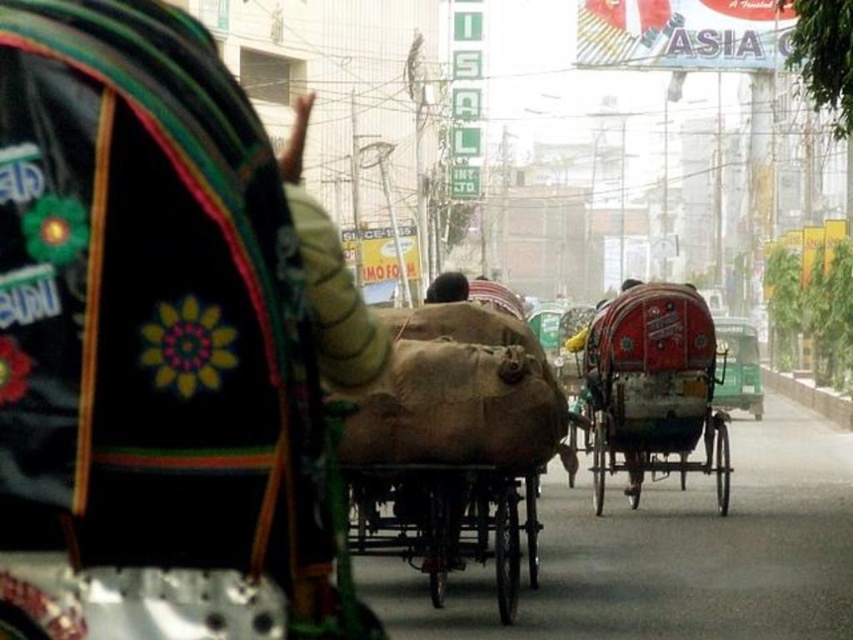
Does red painted wood rickshaw at center appear over brown fabric cart at center?

Indeed, red painted wood rickshaw at center is positioned over brown fabric cart at center.

Between red painted wood rickshaw at center and brown fabric cart at center, which one is positioned lower?

brown fabric cart at center is below.

Where is `red painted wood rickshaw at center`? Image resolution: width=853 pixels, height=640 pixels. red painted wood rickshaw at center is located at coordinates (653, 387).

Which is below, brown fabric cart at center or brown fabric bag at center?

brown fabric cart at center

Locate an element on the screen. The image size is (853, 640). brown fabric cart at center is located at coordinates (445, 522).

Is red painted wood rickshaw at center below brown fabric bag at center?

Correct, red painted wood rickshaw at center is located below brown fabric bag at center.

Image resolution: width=853 pixels, height=640 pixels. In order to click on red painted wood rickshaw at center in this screenshot , I will do `click(653, 387)`.

The width and height of the screenshot is (853, 640). In order to click on red painted wood rickshaw at center in this screenshot , I will do `click(653, 387)`.